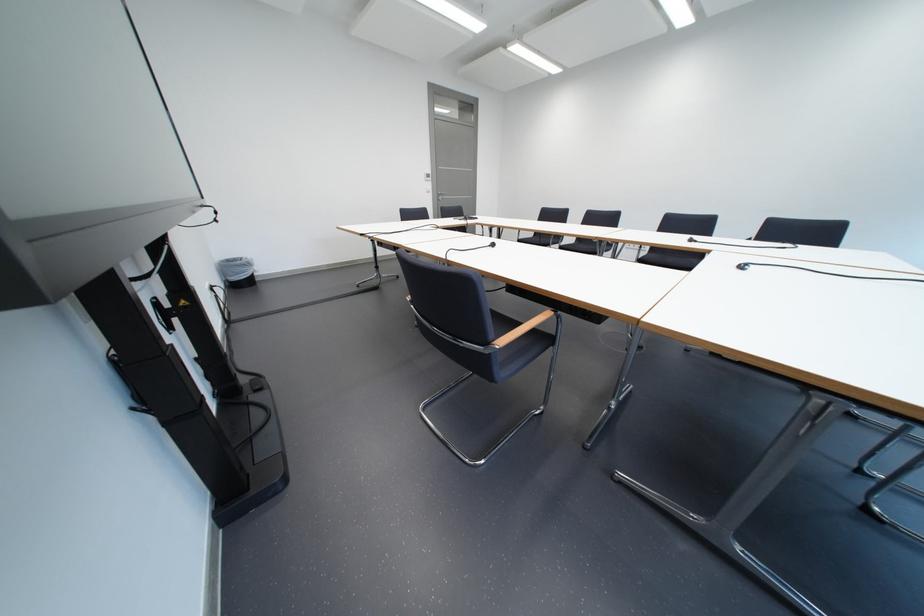
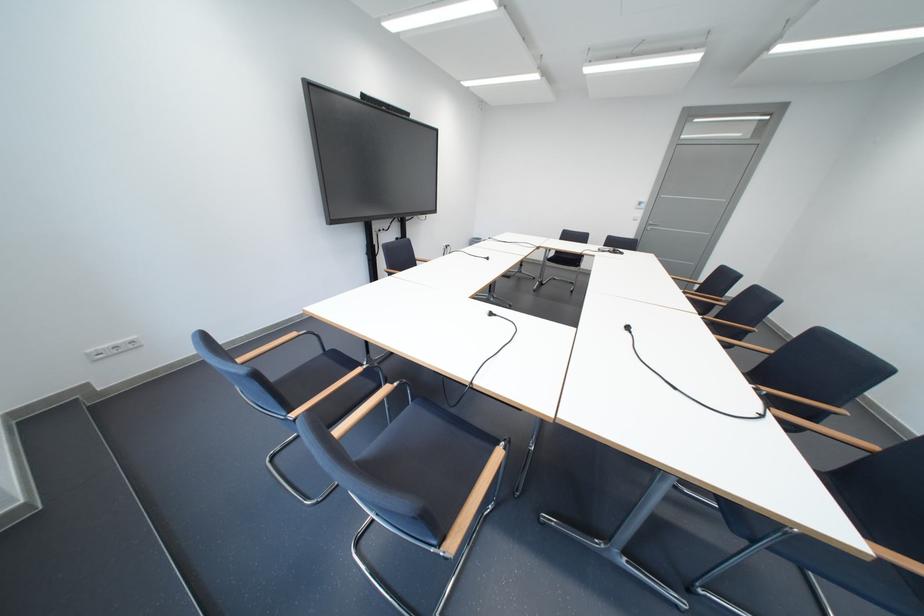
Find the pixel in the second image that matches point (755, 268) in the first image.

(503, 315)